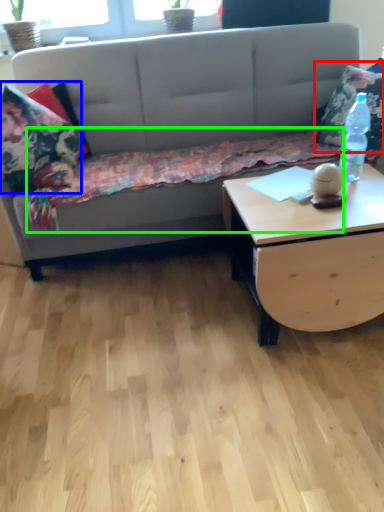
Question: Based on their relative distances, which object is farther from throw pillow (highlighted by a red box)? Choose from pillow (highlighted by a blue box) and blanket (highlighted by a green box).

Choices:
 (A) pillow
 (B) blanket

Answer: (A)